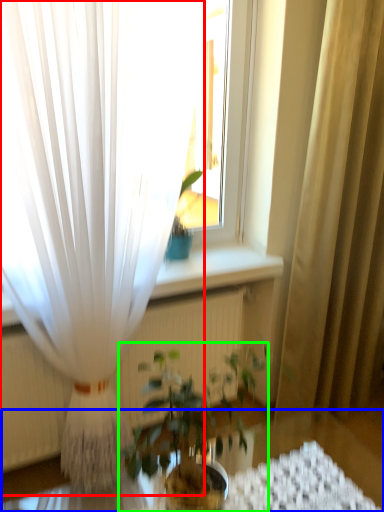
Question: Based on their relative distances, which object is nearer to curtain (highlighted by a red box)? Choose from round table (highlighted by a blue box) and houseplant (highlighted by a green box).

Choices:
 (A) round table
 (B) houseplant

Answer: (B)